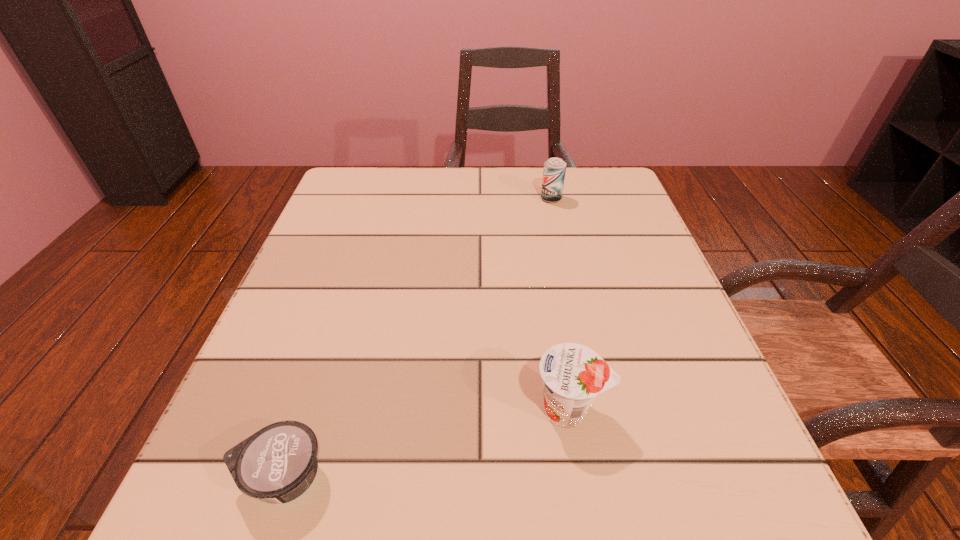
Identify the location of object present at the left edge. The image size is (960, 540). 277,464.

You are a GUI agent. You are given a task and a screenshot of the screen. Output one action in this format:
    pyautogui.click(x=<x>, y=<y>)
    Task: Click on the object at the near left corner
    This screenshot has width=960, height=540.
    Given the screenshot: What is the action you would take?
    pyautogui.click(x=277, y=464)

The width and height of the screenshot is (960, 540). I want to click on free point at the far edge, so click(x=468, y=205).

Locate an element on the screen. The height and width of the screenshot is (540, 960). vacant space at the near edge of the desktop is located at coordinates (353, 530).

In the image, there is a desktop. In order to click on free region at the left edge in this screenshot , I will do `click(319, 403)`.

The width and height of the screenshot is (960, 540). I want to click on vacant space at the right edge, so click(629, 353).

This screenshot has height=540, width=960. I want to click on blank space at the far left corner of the desktop, so click(x=393, y=173).

The image size is (960, 540). In the image, there is a desktop. In order to click on vacant space at the far right corner in this screenshot , I will do `click(623, 183)`.

The image size is (960, 540). What are the coordinates of `vacant space at the near right corner` in the screenshot? It's located at click(x=758, y=531).

At what (x,y) coordinates should I click in order to perform the action: click on vacant region between the shorter yogurt and the second nearest object. Please return your answer as a coordinate pair (x, y). Image resolution: width=960 pixels, height=540 pixels. Looking at the image, I should click on (426, 444).